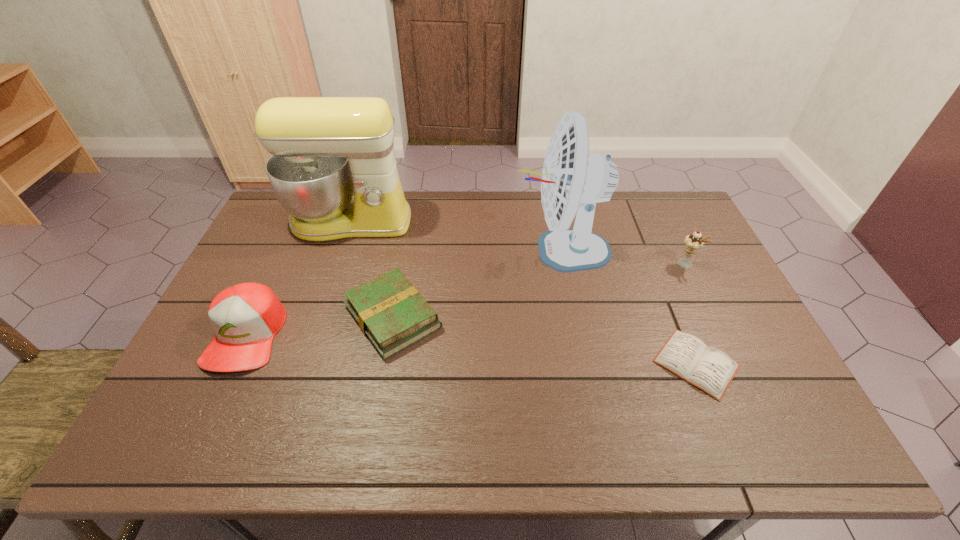
Locate an element on the screen. free point between the fan and the third tallest object is located at coordinates (623, 258).

The width and height of the screenshot is (960, 540). I want to click on free space between the book and the baseball cap, so click(x=320, y=326).

Identify the location of vacant region between the fifth tallest object and the mixer. The height and width of the screenshot is (540, 960). (372, 269).

Identify the location of vacant space that's between the fourth shortest object and the second shortest object. This screenshot has width=960, height=540. (540, 291).

The height and width of the screenshot is (540, 960). Find the location of `free space between the third tallest object and the mixer`. free space between the third tallest object and the mixer is located at coordinates (517, 243).

I want to click on vacant region between the second shortest object and the fourth object from left to right, so (x=477, y=284).

Find the location of `vacant point located between the mixer and the icecream`. vacant point located between the mixer and the icecream is located at coordinates (517, 243).

Find the location of a particular element. object that stands as the closest to the fourth tallest object is located at coordinates (392, 314).

Locate which object ranks in proximity to the book. Please provide its 2D coordinates. Your answer should be formatted as a tuple, i.e. [(x, y)], where the tuple contains the x and y coordinates of a point satisfying the conditions above.

[(245, 317)]

Identify the location of vacant space that satisfies the following two spatial constraints: 1. on the side of the mixer with the control knob; 2. on the left side of the shortest object. This screenshot has width=960, height=540. (302, 363).